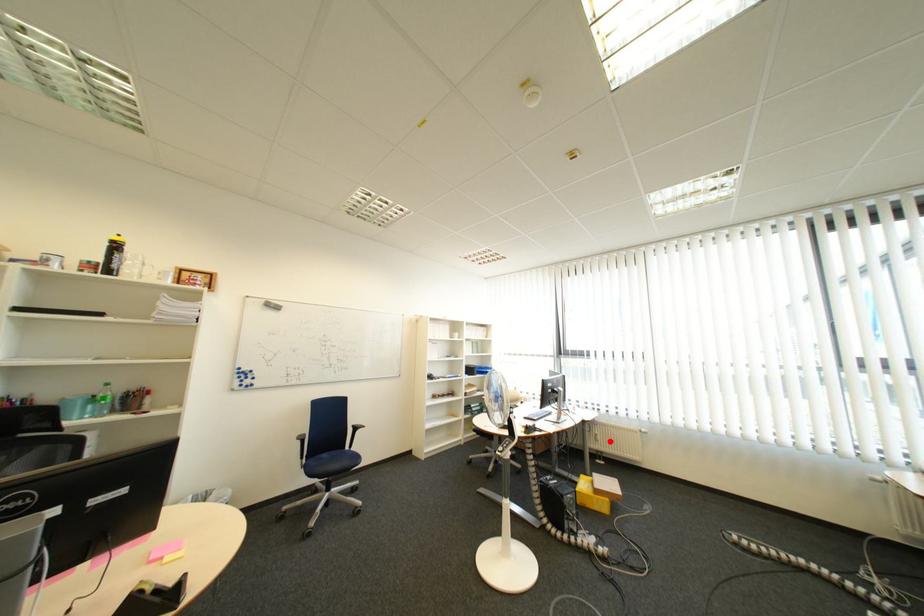
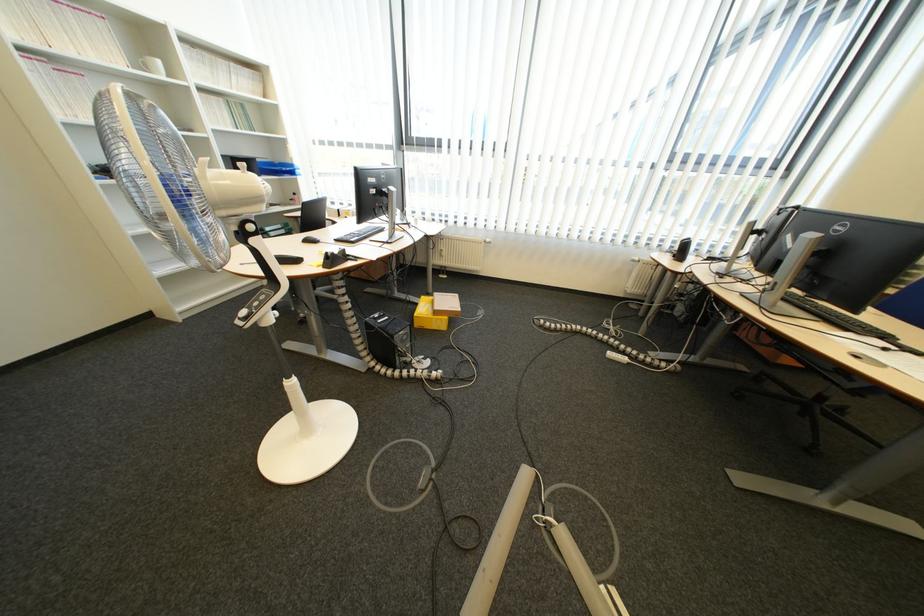
Where in the second image is the point corresponding to the highlighted location from the first image?

(455, 257)